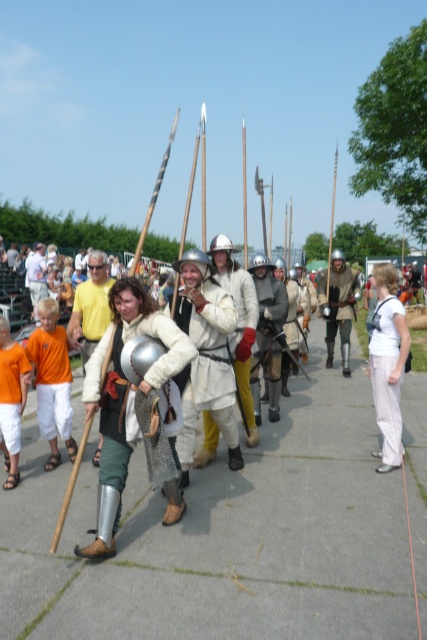
Question: Considering the relative positions of white cotton pants at center and leather armor at center in the image provided, where is white cotton pants at center located with respect to leather armor at center?

Choices:
 (A) above
 (B) below

Answer: (B)

Question: Is white cotton pants at center thinner than silver metallic helmet at center?

Choices:
 (A) yes
 (B) no

Answer: (A)

Question: Which of the following is the closest to the observer?

Choices:
 (A) orange cotton shirt at left
 (B) leather armor at center

Answer: (A)

Question: Among these objects, which one is nearest to the camera?

Choices:
 (A) orange cotton shirt at left
 (B) leather armor at center

Answer: (A)

Question: Among these points, which one is nearest to the camera?

Choices:
 (A) (93, 342)
 (B) (184, 349)
 (C) (386, 384)
 (D) (58, 460)

Answer: (B)

Question: Is white cotton pants at center below silver metallic helmet at center?

Choices:
 (A) yes
 (B) no

Answer: (A)